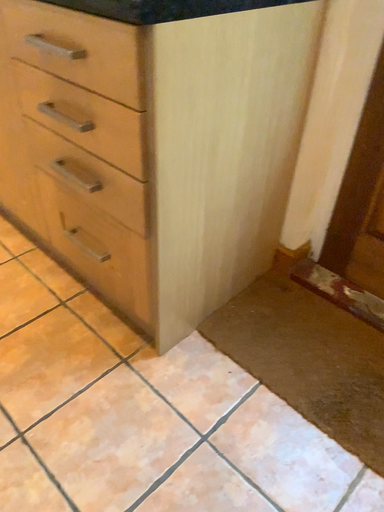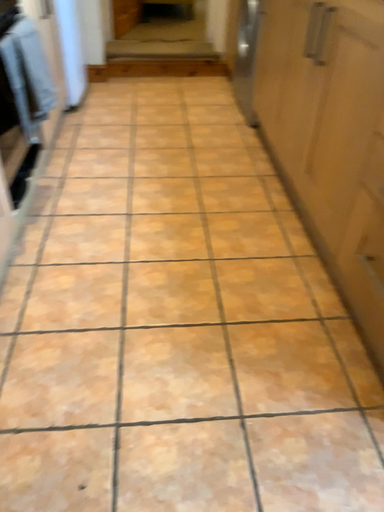
Question: Which way did the camera rotate in the video?

Choices:
 (A) rotated left
 (B) rotated right

Answer: (A)